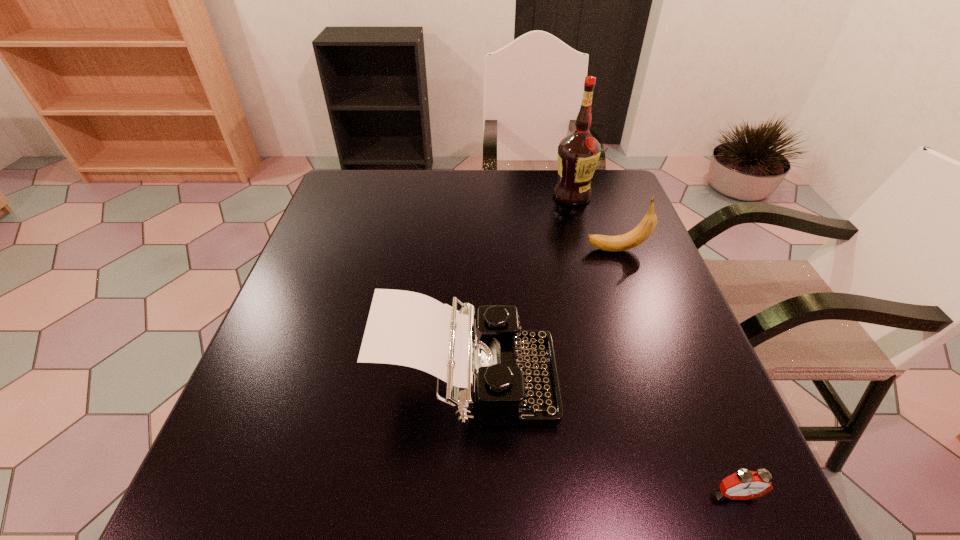
Locate an element on the screen. The image size is (960, 540). blank space at the near edge is located at coordinates (421, 503).

Locate an element on the screen. The image size is (960, 540). free space at the left edge of the desktop is located at coordinates (273, 400).

You are a GUI agent. You are given a task and a screenshot of the screen. Output one action in this format:
    pyautogui.click(x=<x>, y=<y>)
    Task: Click on the free region at the right edge of the desktop
    Image resolution: width=960 pixels, height=540 pixels.
    Given the screenshot: What is the action you would take?
    pyautogui.click(x=650, y=305)

Image resolution: width=960 pixels, height=540 pixels. Identify the location of vacant region at the far right corner of the desktop. (592, 213).

Where is `free area in between the leftmost object and the second farthest object`? Image resolution: width=960 pixels, height=540 pixels. free area in between the leftmost object and the second farthest object is located at coordinates (542, 316).

Find the location of a particular element. Image resolution: width=960 pixels, height=540 pixels. free spot between the tallest object and the third nearest object is located at coordinates (594, 223).

Find the location of a particular element. This screenshot has width=960, height=540. vacant area between the third nearest object and the nearest object is located at coordinates (676, 372).

Image resolution: width=960 pixels, height=540 pixels. I want to click on vacant region between the tallest object and the third farthest object, so click(520, 289).

Identify the location of unoccupied area between the shortest object and the banana. The image size is (960, 540). (676, 372).

You are a GUI agent. You are given a task and a screenshot of the screen. Output one action in this format:
    pyautogui.click(x=<x>, y=<y>)
    Task: Click on the free area in between the typewriter and the banana
    The height and width of the screenshot is (540, 960).
    Given the screenshot: What is the action you would take?
    pyautogui.click(x=542, y=316)